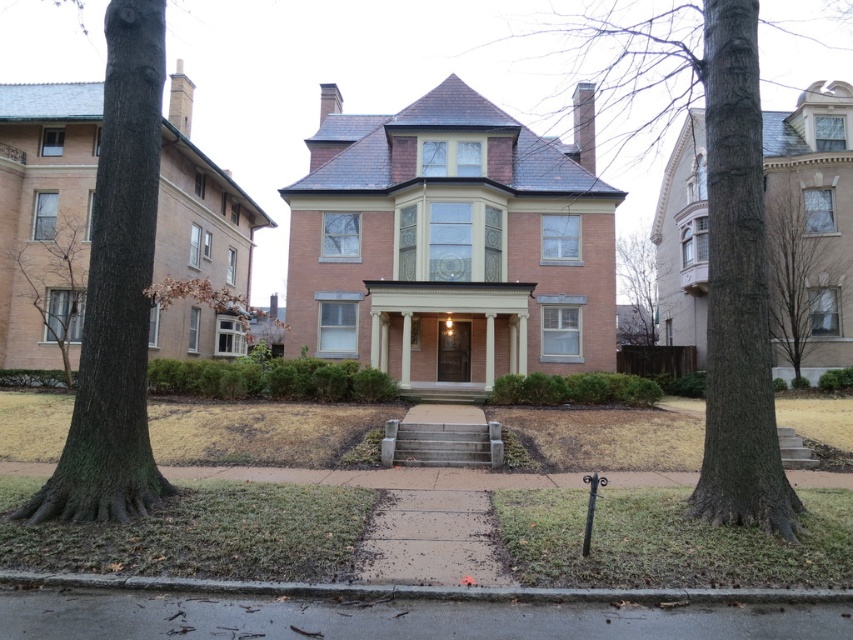
You are standing in front of the house and want to determine the relative positions of two points marked on the facade. Which point is nearer to you, point at coordinates (128, 268) or point at coordinates (805, 321)?

Point at coordinates (128, 268) is closer to the viewer than point at coordinates (805, 321).